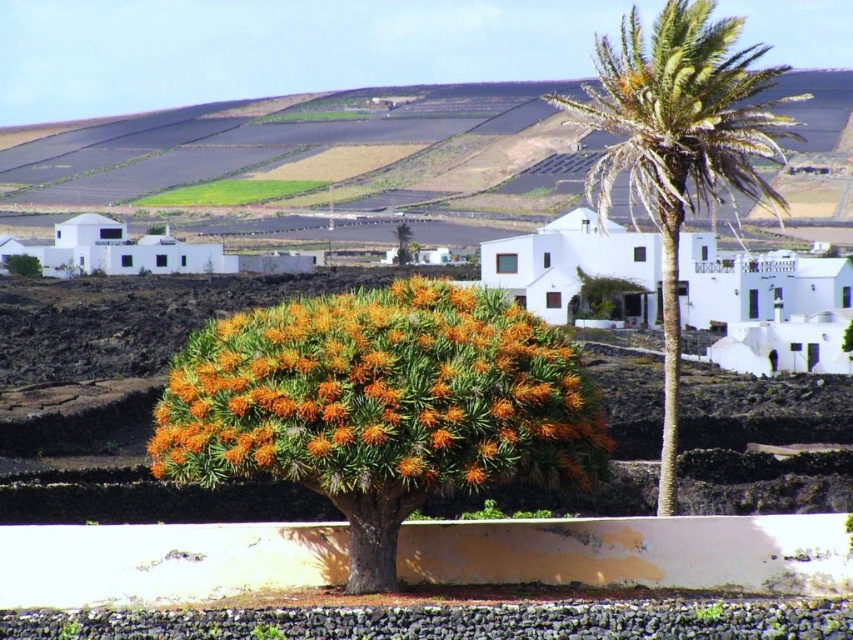
You are standing at point (381, 396) in the landscape. What object is directly in front of you?

The orange fuzzy bush at center is directly in front of you at point (381, 396).

Based on the photo, you are a gardener planning to plant a new shrub in a space where the orange fuzzy bush at center currently grows. The new shrub requires a space wider than the current one. Based on the scene, can you determine if the green leafy palm at upper right has enough width to accommodate the new shrub?

The orange fuzzy bush at center is narrower than the green leafy palm at upper right, so the green leafy palm at upper right has sufficient width to accommodate the new shrub that requires more space.

You are standing in front of the landscape scene and notice two points marked in the image. Which point, point (x=601, y=202) or point (x=401, y=230), is nearer to you?

Point (x=601, y=202) is closer to the viewer than point (x=401, y=230).